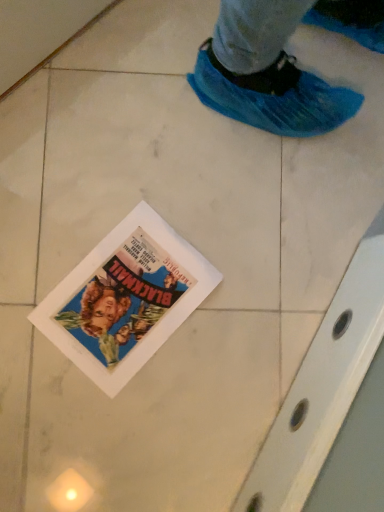
The image size is (384, 512). Find the location of `vacant space to the right of white paper at center`. vacant space to the right of white paper at center is located at coordinates (235, 349).